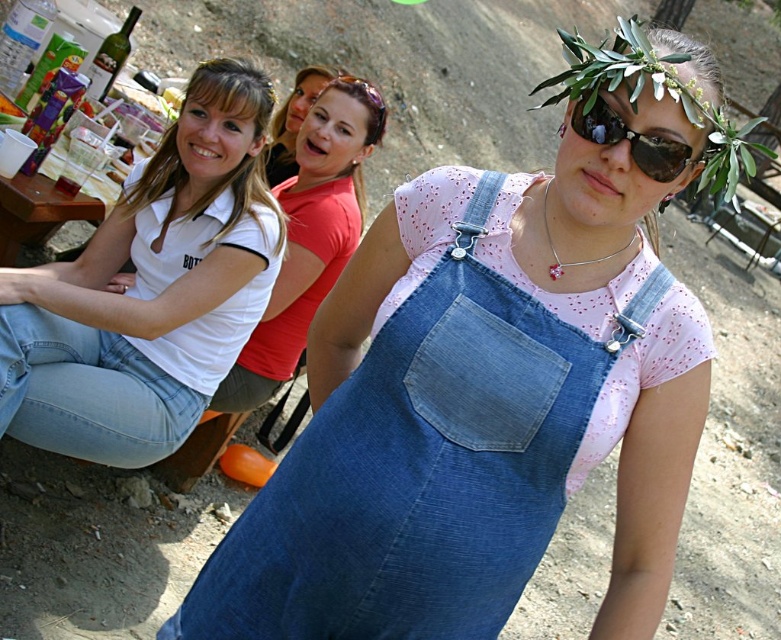
You are standing at the origin point in the image and see two points labeled as point (x=603, y=141) and point (x=287, y=128). Which point is closer to you?

Point (x=603, y=141) is in front of point (x=287, y=128), so it is closer to you.